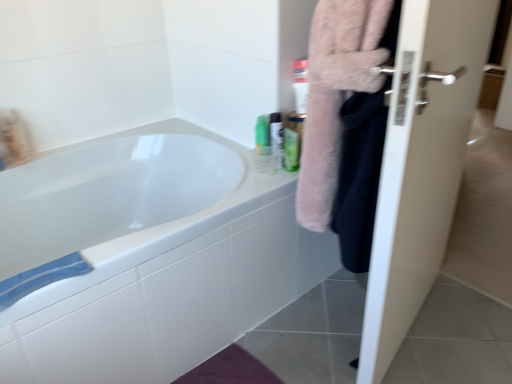
I want to click on vacant area to the left of white glossy door at right, so click(309, 331).